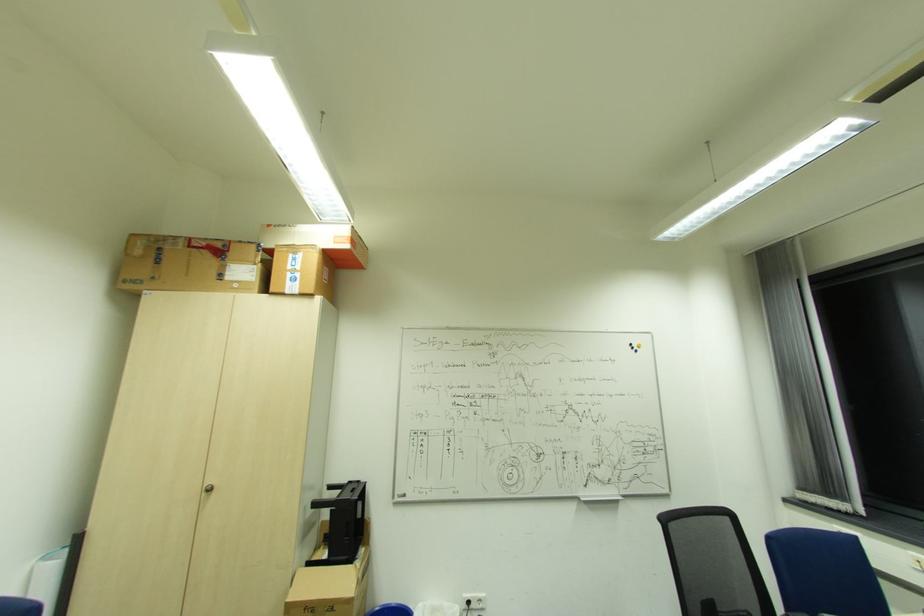
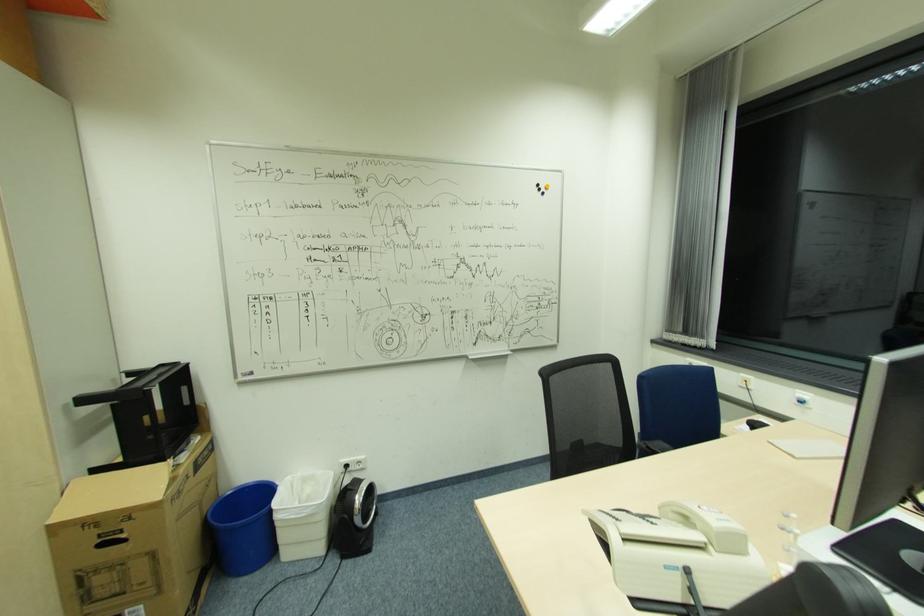
Which direction would the cameraman need to move to produce the second image?

The cameraman walked toward right, forward.